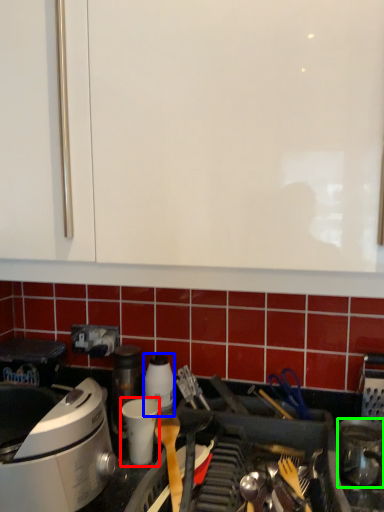
Question: Which is farther away from appliance (highlighted by a red box)? kitchen appliance (highlighted by a blue box) or kitchen appliance (highlighted by a green box)?

Choices:
 (A) kitchen appliance
 (B) kitchen appliance

Answer: (B)